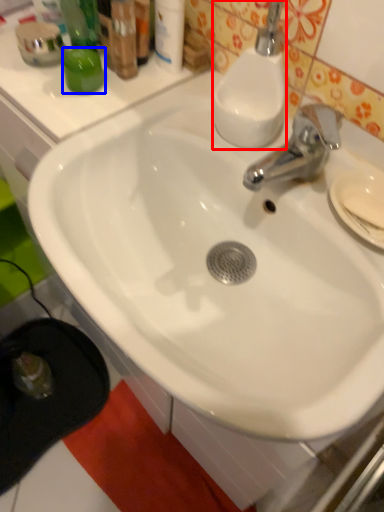
Question: Among these objects, which one is nearest to the camera, soap dispenser (highlighted by a red box) or liquid (highlighted by a blue box)?

Choices:
 (A) soap dispenser
 (B) liquid

Answer: (A)